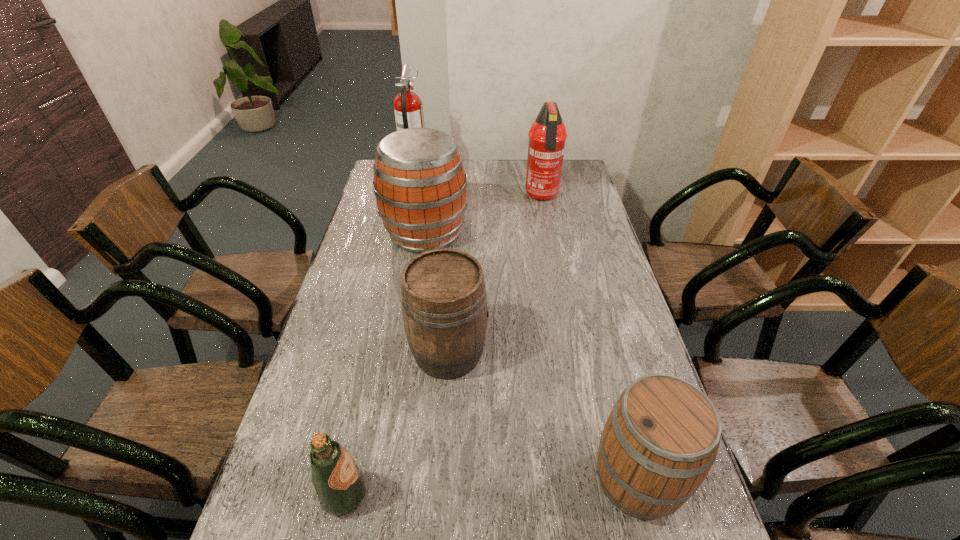
The image size is (960, 540). In order to click on empty space between the rightmost cider and the fourth farthest object in this screenshot , I will do `click(543, 416)`.

You are a GUI agent. You are given a task and a screenshot of the screen. Output one action in this format:
    pyautogui.click(x=<x>, y=<y>)
    Task: Click on the vacant region between the olive oil and the second farthest cider
    
    Given the screenshot: What is the action you would take?
    pyautogui.click(x=396, y=424)

At what (x,y) coordinates should I click in order to perform the action: click on vacant area that lies between the taller fire extinguisher and the second farthest object. Please return your answer as a coordinate pair (x, y). Looking at the image, I should click on (478, 184).

Locate which object is the fourth closest to the fourth farthest object. Please provide its 2D coordinates. Your answer should be formatted as a tuple, i.e. [(x, y)], where the tuple contains the x and y coordinates of a point satisfying the conditions above.

[(547, 135)]

Select which object appears as the third closest to the olive oil. Please provide its 2D coordinates. Your answer should be formatted as a tuple, i.e. [(x, y)], where the tuple contains the x and y coordinates of a point satisfying the conditions above.

[(420, 186)]

The width and height of the screenshot is (960, 540). I want to click on the second closest cider to the tallest cider, so click(x=661, y=439).

Point out which cider is positioned as the second nearest to the olive oil. Please provide its 2D coordinates. Your answer should be formatted as a tuple, i.e. [(x, y)], where the tuple contains the x and y coordinates of a point satisfying the conditions above.

[(661, 439)]

Locate an element on the screen. The height and width of the screenshot is (540, 960). free location that satisfies the following two spatial constraints: 1. on the trigger side of the shorter fire extinguisher; 2. on the side of the third nearest object near the bung hole is located at coordinates (572, 353).

Image resolution: width=960 pixels, height=540 pixels. Find the location of `vacant area that satisfies the following two spatial constraints: 1. on the side of the rightmost cider near the bung hole; 2. on the left side of the third nearest object`. vacant area that satisfies the following two spatial constraints: 1. on the side of the rightmost cider near the bung hole; 2. on the left side of the third nearest object is located at coordinates (441, 480).

Locate an element on the screen. free point that satisfies the following two spatial constraints: 1. on the front side of the farthest cider; 2. on the right side of the nearest cider is located at coordinates (388, 480).